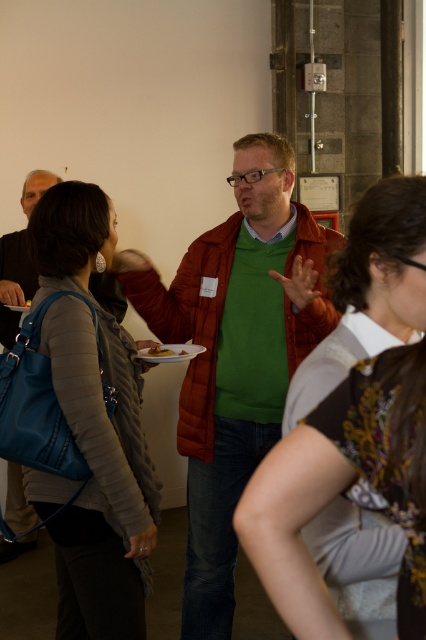
You are a guest at this event and want to retrieve your matte blue leather handbag at left without moving the matte green sweater at center. Is this possible?

The matte blue leather handbag at left is behind the matte green sweater at center, so you can retrieve it without moving the matte green sweater at center by reaching around or stepping aside.